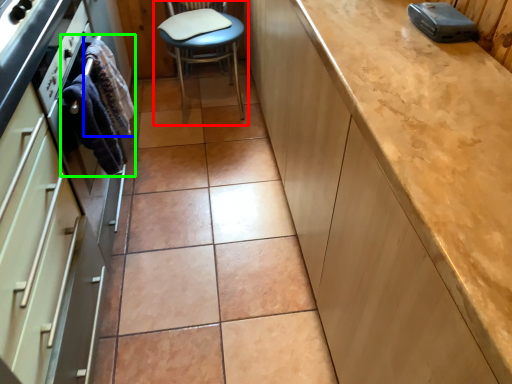
Question: Estimate the real-world distances between objects in this image. Which object is farther from chair (highlighted by a red box), material (highlighted by a blue box) or material (highlighted by a green box)?

Choices:
 (A) material
 (B) material

Answer: (B)